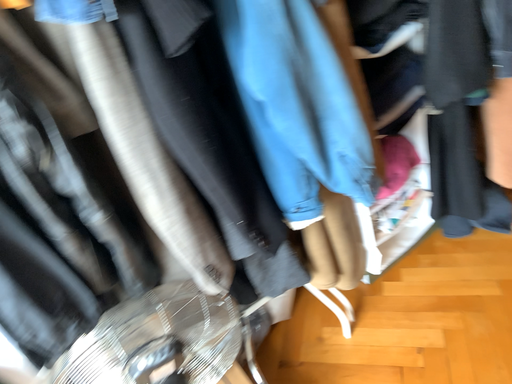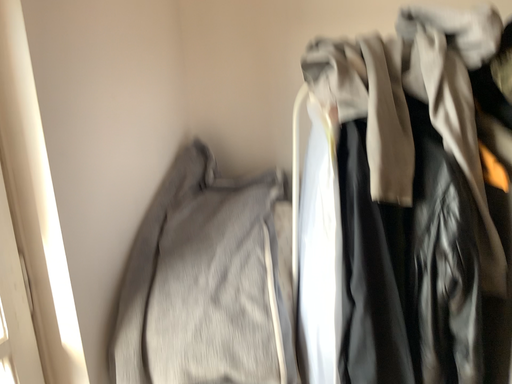
Question: Which way did the camera rotate in the video?

Choices:
 (A) rotated left
 (B) rotated right

Answer: (A)